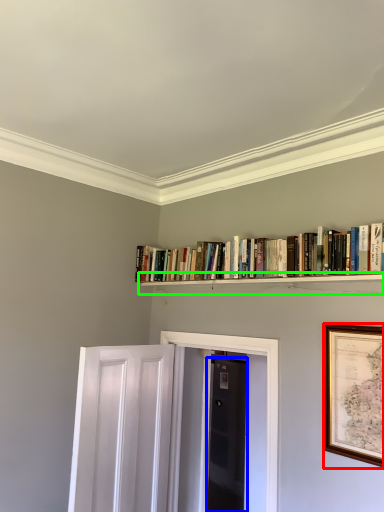
Question: Estimate the real-world distances between objects in this image. Which object is closer to picture frame (highlighted by a red box), door (highlighted by a blue box) or shelf (highlighted by a green box)?

Choices:
 (A) door
 (B) shelf

Answer: (B)